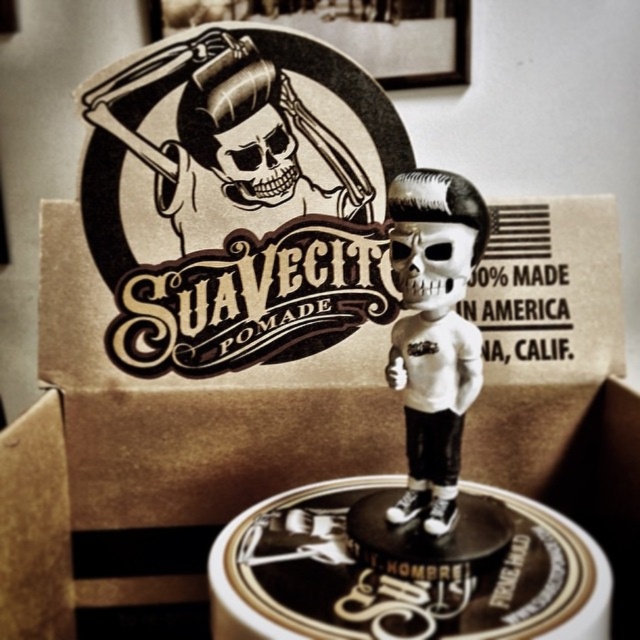
Can you confirm if brown cardboard box at upper center is bigger than matte black skull at center?

Yes, brown cardboard box at upper center is bigger than matte black skull at center.

Is point (17, 477) more distant than point (419, 230)?

That is True.

Which is behind, point (611, 532) or point (401, 272)?

Point (611, 532)

Image resolution: width=640 pixels, height=640 pixels. Identify the location of brown cardboard box at upper center. (156, 456).

Who is higher up, white matte skull at center or black matte skull at center?

black matte skull at center

Is point (444, 189) positioned in front of point (253, 202)?

Yes, it is in front of point (253, 202).

In order to click on white matte skull at center in this screenshot , I will do `click(433, 332)`.

Between point (292, 102) and point (241, 186), which one is positioned in front?

Positioned in front is point (292, 102).

Between black wood skull at center and black matte skull at center, which one is positioned higher?

black matte skull at center is above.

Where is `black wood skull at center`? black wood skull at center is located at coordinates (250, 154).